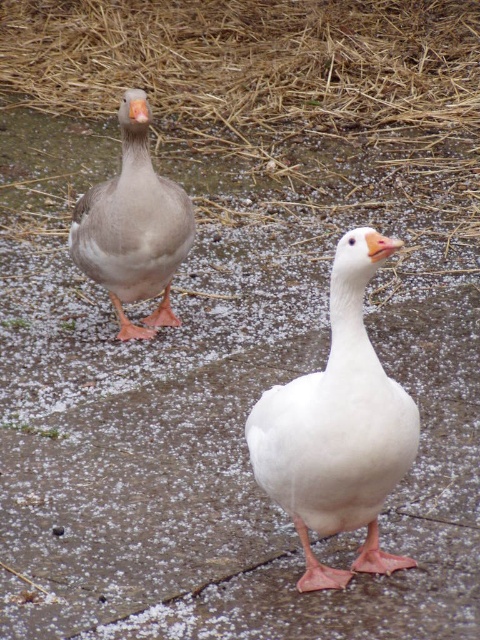
Does brown straw at upper center appear on the left side of orange matte beak at center?

Yes, brown straw at upper center is to the left of orange matte beak at center.

Who is lower down, brown straw at upper center or orange matte beak at center?

orange matte beak at center

Find the location of a particular element. brown straw at upper center is located at coordinates (272, 80).

You are a GUI agent. You are given a task and a screenshot of the screen. Output one action in this format:
    pyautogui.click(x=<x>, y=<y>)
    Task: Click on the gray matte duck at center
    
    Given the screenshot: What is the action you would take?
    pyautogui.click(x=132, y=230)

Is gray matte duck at center smaller than matte gray beak at upper left?

Actually, gray matte duck at center might be larger than matte gray beak at upper left.

Identify the location of gray matte duck at center. (132, 230).

Is white matte duck at center to the left of matte gray beak at upper left from the viewer's perspective?

In fact, white matte duck at center is to the right of matte gray beak at upper left.

Is white matte duck at center wider than matte gray beak at upper left?

Yes.

Is point (368, 492) closer to viewer compared to point (146, 120)?

That is True.

You are a GUI agent. You are given a task and a screenshot of the screen. Output one action in this format:
    pyautogui.click(x=<x>, y=<y>)
    Task: Click on the white matte duck at center
    The image size is (480, 640).
    Given the screenshot: What is the action you would take?
    pyautogui.click(x=336, y=433)